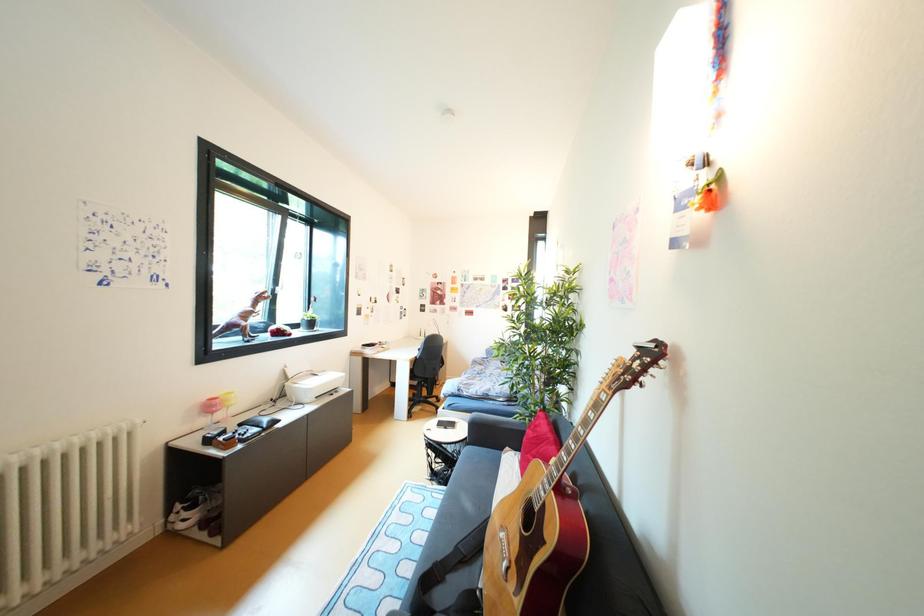
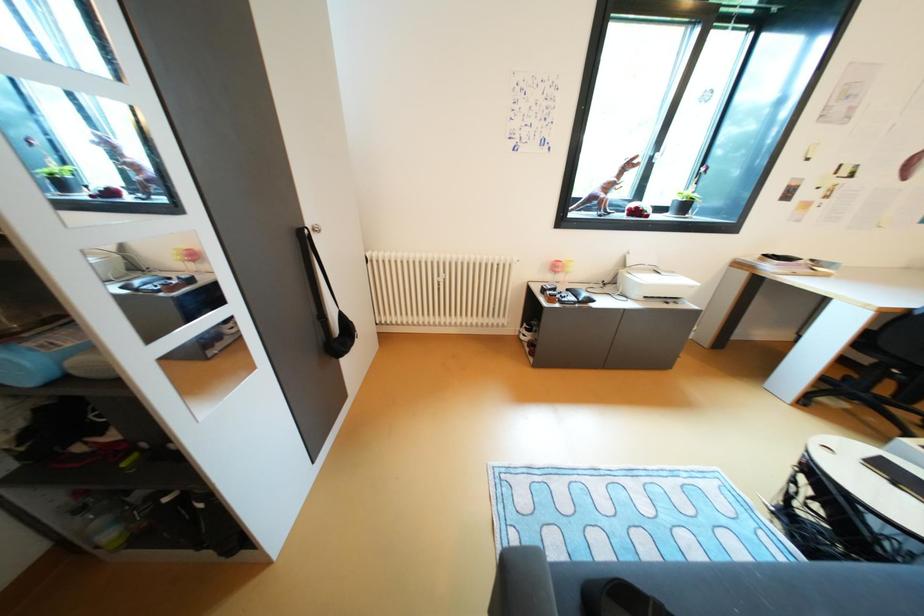
First-person continuous shooting, in which direction is the camera rotating?

The camera rotated toward left-down.